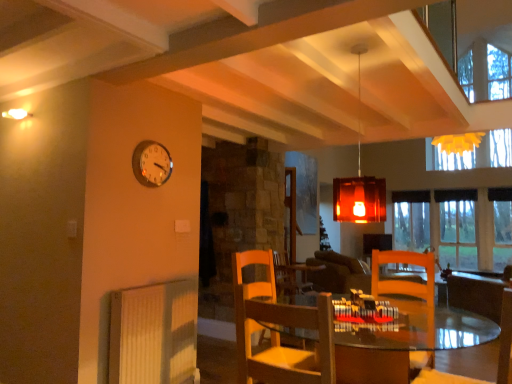
Question: Would you say wooden chair at lower right, acting as the second chair starting from the left, is to the left or to the right of wooden chair at center, the first chair positioned from the left, in the picture?

Choices:
 (A) left
 (B) right

Answer: (B)

Question: From a real-world perspective, is wooden chair at lower right, acting as the 1th chair starting from the right, above or below wooden chair at center, the first chair positioned from the left?

Choices:
 (A) below
 (B) above

Answer: (A)

Question: Which of these objects is positioned closest to the wooden chair at lower right, acting as the second chair starting from the left?

Choices:
 (A) wooden table at center
 (B) clear glass window at center
 (C) dark brown leather couch at center
 (D) translucent amber glass pendant light at center
 (E) wooden chair at center, the first chair positioned from the left

Answer: (A)

Question: Estimate the real-world distances between objects in this image. Which object is closer to the wooden chair at center, the 2th chair positioned from the right?

Choices:
 (A) dark brown leather couch at center
 (B) white ribbed radiator at lower left
 (C) wooden table at center
 (D) wooden chair at lower right, acting as the 1th chair starting from the right
 (E) white glossy clock at upper left

Answer: (B)